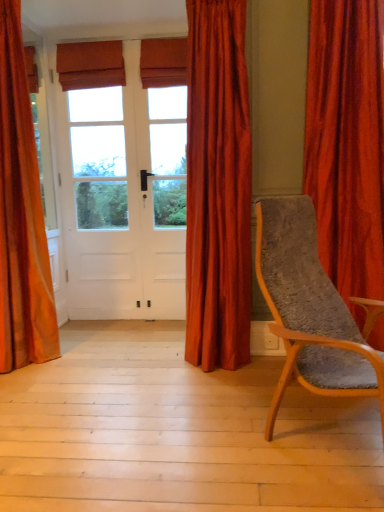
Question: Is wooden textured chair at right in contact with velvet orange curtain at right, the first curtain viewed from the right?

Choices:
 (A) no
 (B) yes

Answer: (A)

Question: Considering the relative sizes of wooden textured chair at right and velvet orange curtain at right, the first curtain viewed from the right, in the image provided, is wooden textured chair at right taller than velvet orange curtain at right, the first curtain viewed from the right,?

Choices:
 (A) yes
 (B) no

Answer: (B)

Question: Does wooden textured chair at right lie in front of velvet orange curtain at right, the first curtain viewed from the right?

Choices:
 (A) no
 (B) yes

Answer: (B)

Question: Does wooden textured chair at right have a lesser width compared to velvet orange curtain at right, the first curtain viewed from the right?

Choices:
 (A) no
 (B) yes

Answer: (A)

Question: Does wooden textured chair at right have a smaller size compared to velvet orange curtain at right, arranged as the 3th curtain when viewed from the left?

Choices:
 (A) yes
 (B) no

Answer: (B)

Question: Is wooden textured chair at right further to the viewer compared to velvet orange curtain at right, arranged as the 3th curtain when viewed from the left?

Choices:
 (A) no
 (B) yes

Answer: (A)

Question: Is satin red curtain at center, which is the 2th curtain in right-to-left order, shorter than wooden textured chair at right?

Choices:
 (A) yes
 (B) no

Answer: (B)

Question: Can you confirm if satin red curtain at center, which is the 2th curtain in right-to-left order, is thinner than wooden textured chair at right?

Choices:
 (A) yes
 (B) no

Answer: (A)

Question: From a real-world perspective, does satin red curtain at center, positioned as the 2th curtain in left-to-right order, sit lower than wooden textured chair at right?

Choices:
 (A) yes
 (B) no

Answer: (B)

Question: Is satin red curtain at center, which is the 2th curtain in right-to-left order, to the right of wooden textured chair at right from the viewer's perspective?

Choices:
 (A) no
 (B) yes

Answer: (A)

Question: Is satin red curtain at center, which is the 2th curtain in right-to-left order, oriented away from wooden textured chair at right?

Choices:
 (A) yes
 (B) no

Answer: (B)

Question: Considering the relative sizes of satin red curtain at center, which is the 2th curtain in right-to-left order, and wooden textured chair at right in the image provided, is satin red curtain at center, which is the 2th curtain in right-to-left order, wider than wooden textured chair at right?

Choices:
 (A) no
 (B) yes

Answer: (A)

Question: Considering the relative sizes of light wood floor at lower center and satin red curtain at center, which is the 2th curtain in right-to-left order, in the image provided, is light wood floor at lower center shorter than satin red curtain at center, which is the 2th curtain in right-to-left order,?

Choices:
 (A) yes
 (B) no

Answer: (A)